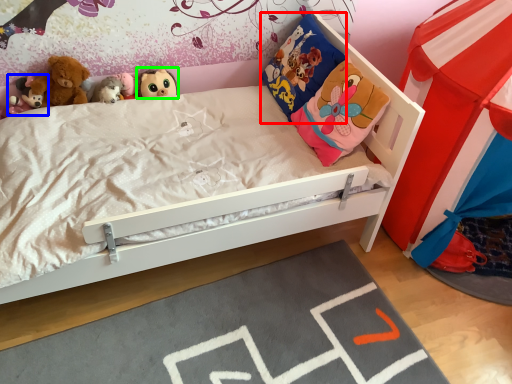
Question: Which object is the closest to the pillow (highlighted by a red box)? Choose among these: toy (highlighted by a blue box) or toy (highlighted by a green box).

Choices:
 (A) toy
 (B) toy

Answer: (B)